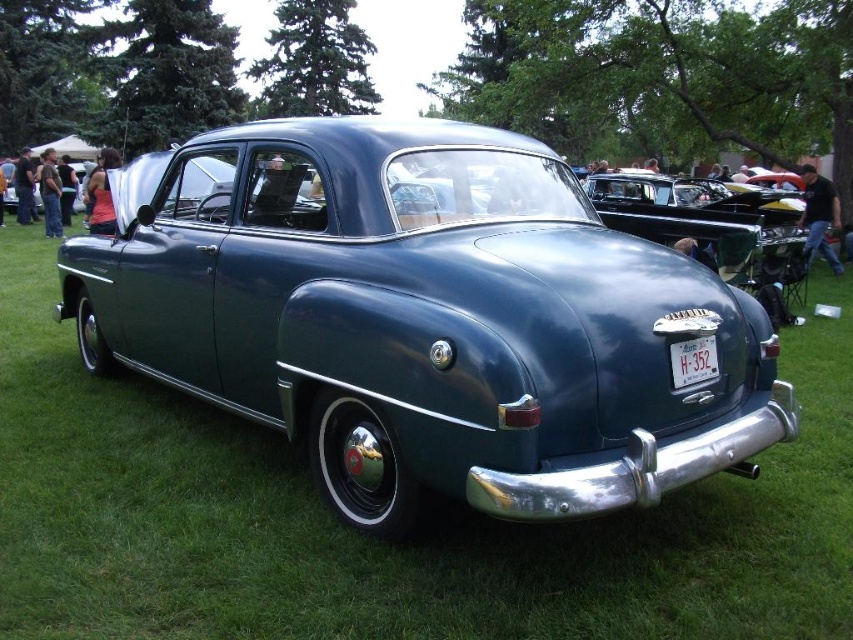
Is metallic blue car at center below white plastic license plate at center?

No.

Is metallic blue car at center closer to the viewer compared to white plastic license plate at center?

Yes, it is in front of white plastic license plate at center.

Is point (265, 177) farther from viewer compared to point (677, 344)?

Yes, it is.

Where is `metallic blue car at center`? The image size is (853, 640). metallic blue car at center is located at coordinates click(422, 317).